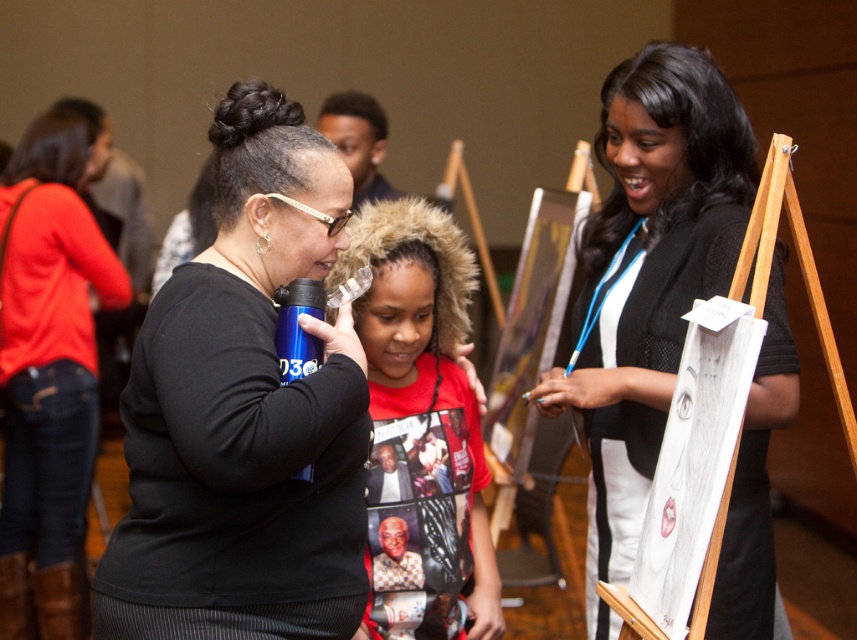
Between smooth black sweater at center and matte black shirt at center, which one has more height?

matte black shirt at center is taller.

Based on the photo, does smooth black sweater at center have a smaller size compared to matte black shirt at center?

Actually, smooth black sweater at center might be larger than matte black shirt at center.

The width and height of the screenshot is (857, 640). Describe the element at coordinates (650, 269) in the screenshot. I see `smooth black sweater at center` at that location.

The height and width of the screenshot is (640, 857). In order to click on smooth black sweater at center in this screenshot , I will do [x=650, y=269].

Can you confirm if blue matte water bottle at center is taller than red cotton hoodie at center?

No.

Between blue matte water bottle at center and red cotton hoodie at center, which one has less height?

blue matte water bottle at center is shorter.

Between point (204, 333) and point (376, 408), which one is positioned behind?

Positioned behind is point (376, 408).

Locate an element on the screen. blue matte water bottle at center is located at coordinates (244, 412).

What do you see at coordinates (650, 269) in the screenshot? I see `smooth black sweater at center` at bounding box center [650, 269].

What are the coordinates of `smooth black sweater at center` in the screenshot? It's located at (650, 269).